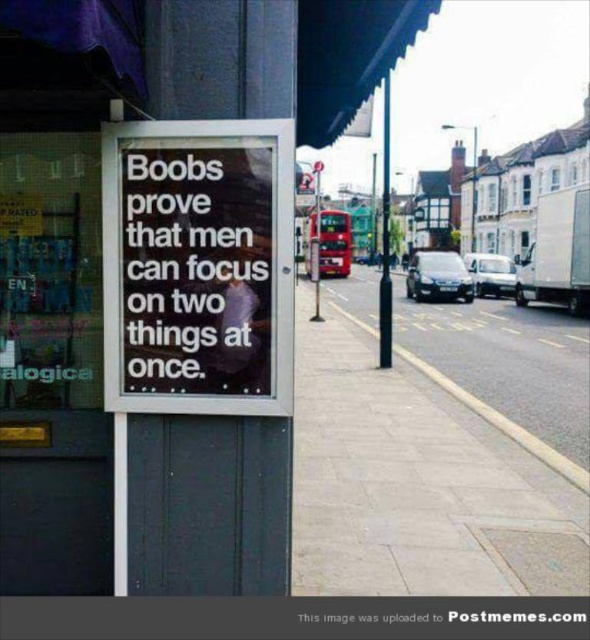
Is black paper at center thinner than red metallic bus at center?

Correct, black paper at center's width is less than red metallic bus at center's.

Between black paper at center and red metallic bus at center, which one has less height?

black paper at center

Is point (227, 262) less distant than point (324, 216)?

Yes, point (227, 262) is in front of point (324, 216).

What are the coordinates of `black paper at center` in the screenshot? It's located at (196, 269).

You are a GUI agent. You are given a task and a screenshot of the screen. Output one action in this format:
    pyautogui.click(x=<x>, y=<y>)
    Task: Click on the gray concrete sidewalk at lower center
    This screenshot has height=640, width=590.
    Given the screenshot: What is the action you would take?
    pyautogui.click(x=417, y=483)

Can you confirm if gray concrete sidewalk at lower center is wider than red metallic bus at center?

Incorrect, gray concrete sidewalk at lower center's width does not surpass red metallic bus at center's.

Is point (457, 566) less distant than point (307, 259)?

Yes, it is.

Where is `gray concrete sidewalk at lower center`? gray concrete sidewalk at lower center is located at coordinates (417, 483).

Can you confirm if black glass sign at center is positioned below black paper at center?

Indeed, black glass sign at center is positioned under black paper at center.

Where is `black glass sign at center`? black glass sign at center is located at coordinates (192, 307).